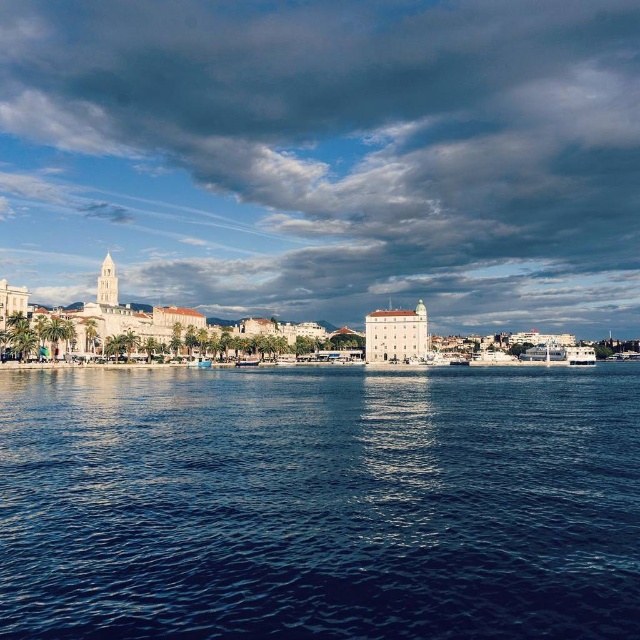
Consider the image. Which is above, cloudy sky at upper center or blue liquid water at center?

Positioned higher is cloudy sky at upper center.

Who is lower down, cloudy sky at upper center or blue liquid water at center?

Positioned lower is blue liquid water at center.

Is point (220, 157) closer to camera compared to point (250, 472)?

No, it is behind (250, 472).

Find the location of `cloudy sky at upper center`. cloudy sky at upper center is located at coordinates click(326, 157).

Is blue liquid water at center positioned in front of white glossy boat at lower left?

Yes.

In the scene shown: Between blue liquid water at center and white glossy boat at lower left, which one appears on the left side from the viewer's perspective?

Positioned to the left is white glossy boat at lower left.

Between point (468, 637) and point (241, 364), which one is positioned behind?

Point (241, 364)

The height and width of the screenshot is (640, 640). In order to click on blue liquid water at center in this screenshot , I will do `click(321, 502)`.

Can you confirm if cloudy sky at upper center is taller than white glossy boat at lower left?

Correct, cloudy sky at upper center is much taller as white glossy boat at lower left.

Is cloudy sky at upper center below white glossy boat at lower left?

No, cloudy sky at upper center is not below white glossy boat at lower left.

Is point (93, 228) closer to viewer compared to point (250, 365)?

No, (93, 228) is further to viewer.

Locate an element on the screen. This screenshot has height=640, width=640. cloudy sky at upper center is located at coordinates (326, 157).